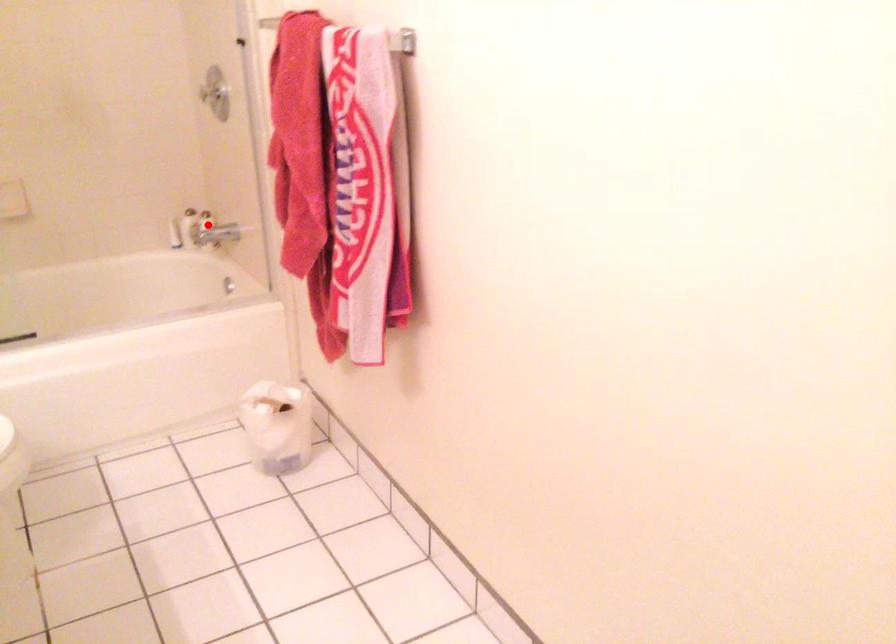
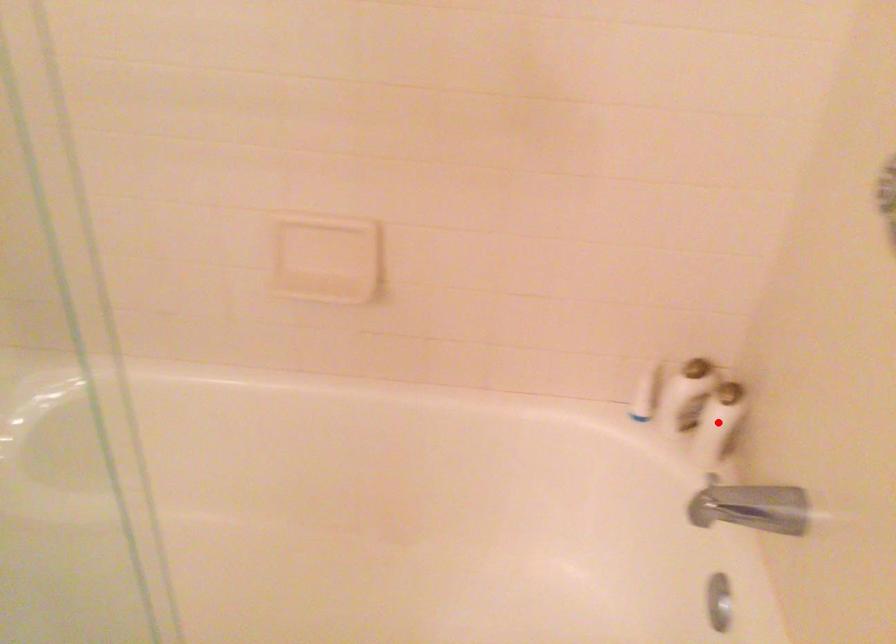
I am providing you with two images of the same scene from different viewpoints. A red point is marked on the first image and another point is marked on the second image. Is the marked point in image1 the same physical position as the marked point in image2?

Yes